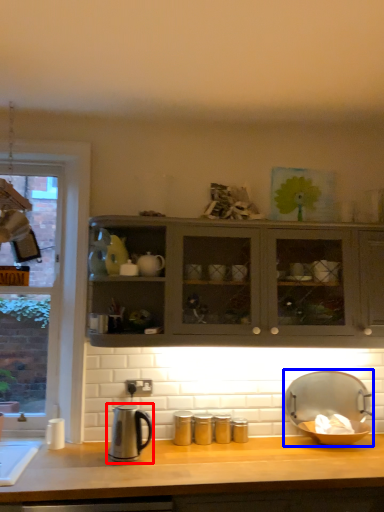
Question: Which point is further to the camera, kitchen appliance (highlighted by a red box) or appliance (highlighted by a blue box)?

Choices:
 (A) kitchen appliance
 (B) appliance

Answer: (B)